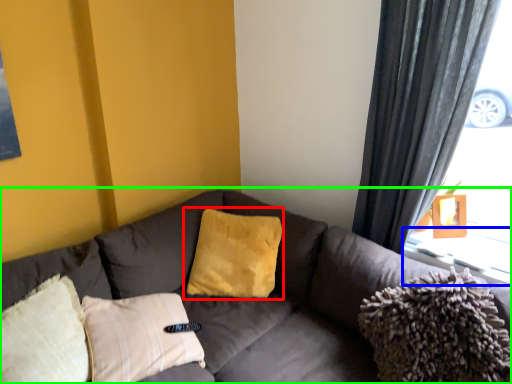
Question: Considering the real-world distances, which object is farthest from pillow (highlighted by a red box)? window sill (highlighted by a blue box) or studio couch (highlighted by a green box)?

Choices:
 (A) window sill
 (B) studio couch

Answer: (A)